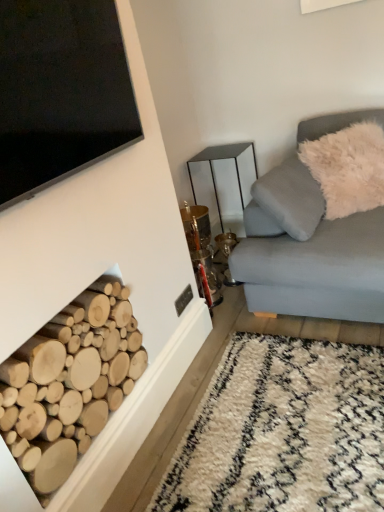
Question: Based on their positions, is white fluffy pillow at upper right located to the left or right of white shaggy rug at lower right?

Choices:
 (A) left
 (B) right

Answer: (B)

Question: From the image's perspective, is white fluffy pillow at upper right positioned above or below white shaggy rug at lower right?

Choices:
 (A) below
 (B) above

Answer: (B)

Question: Based on their relative distances, which object is farther from the metallic mirrored table at center?

Choices:
 (A) natural wood logs at lower left
 (B) white shaggy rug at lower right
 (C) white fluffy pillow at upper right

Answer: (A)

Question: Based on their relative distances, which object is farther from the white shaggy rug at lower right?

Choices:
 (A) metallic mirrored table at center
 (B) white fluffy pillow at upper right
 (C) natural wood logs at lower left

Answer: (A)